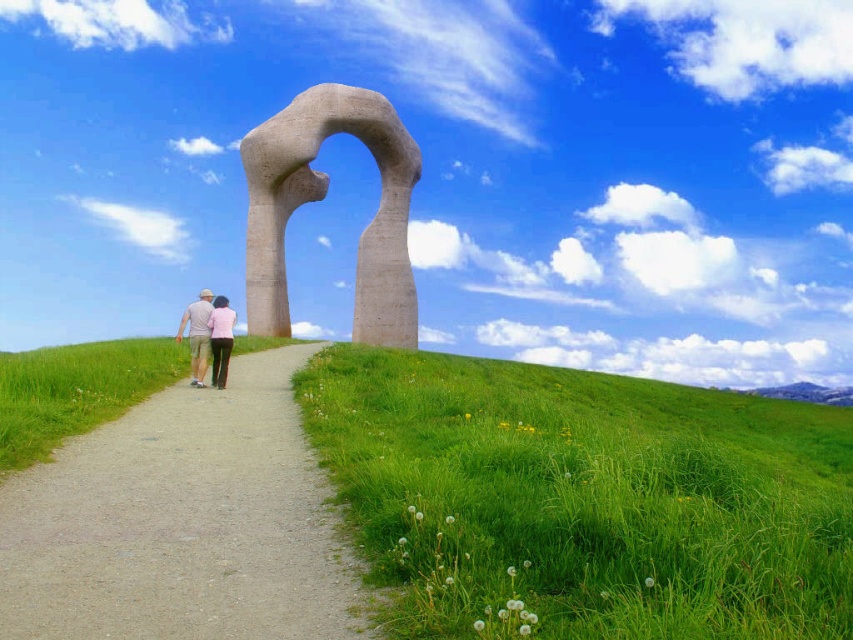
Who is more forward, (846, 461) or (253, 189)?

Point (846, 461) is in front.

Find the location of a particular element. The width and height of the screenshot is (853, 640). green grass at lower right is located at coordinates (584, 497).

Can you confirm if concrete sculpture at center is positioned above light brown fabric pants at center?

Yes, concrete sculpture at center is above light brown fabric pants at center.

The width and height of the screenshot is (853, 640). In order to click on concrete sculpture at center in this screenshot , I will do `click(320, 198)`.

Is point (419, 172) farther from camera compared to point (202, 371)?

Yes, point (419, 172) is behind point (202, 371).

I want to click on concrete sculpture at center, so click(320, 198).

Is concrete sculpture at center to the left of pink fabric at center from the viewer's perspective?

In fact, concrete sculpture at center is to the right of pink fabric at center.

Where is `concrete sculpture at center`? The height and width of the screenshot is (640, 853). concrete sculpture at center is located at coordinates (320, 198).

Which is in front, point (367, 340) or point (213, 300)?

Positioned in front is point (213, 300).

You are a GUI agent. You are given a task and a screenshot of the screen. Output one action in this format:
    pyautogui.click(x=<x>, y=<y>)
    Task: Click on the concrete sculpture at center
    Image resolution: width=853 pixels, height=640 pixels.
    Given the screenshot: What is the action you would take?
    tap(320, 198)